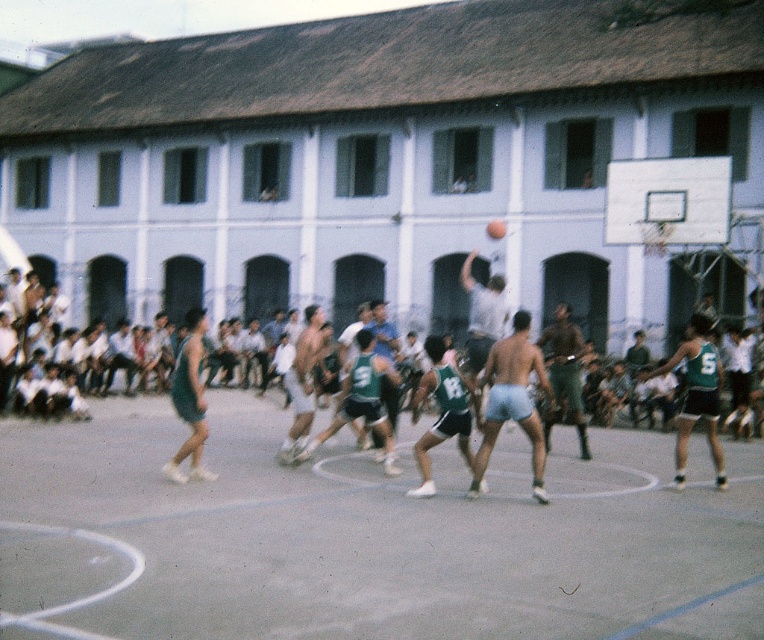
You are a referee standing at the edge of the basketball court. You need to determine if the two players wearing the green jersey at center and dark green shorts at center are within the required 3 meters distance for a legal screen. Based on the image, what is your ruling?

The distance between the green jersey at center and dark green shorts at center is 4.38 meters, which exceeds the 3 meters requirement. Therefore, the players are not within the legal screening distance.

In the scene shown: You are a photographer trying to capture a clear shot of the green jersey at center and the dark green shorts at center. Since you want to focus on the jersey first, which object should you adjust your camera to prioritize in terms of depth?

The green jersey at center is closer to the viewer than the dark green shorts at center, so you should prioritize focusing on the green jersey at center first as it is nearer.

You are a photographer positioned at the edge of the basketball court. You want to take a photo focusing on the green jersey shorts at center and the rubber textured basketball at center. Which object will appear larger in your photo?

The green jersey shorts at center will appear larger in the photo because it is closer to the viewer than the rubber textured basketball at center.